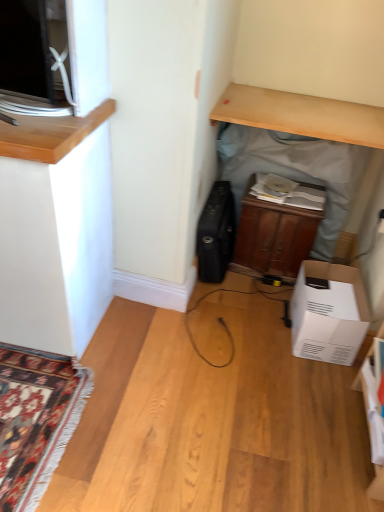
This screenshot has width=384, height=512. Find the location of `vacant space that is in between wooden cabinet at center and black matte suitcase at center`. vacant space that is in between wooden cabinet at center and black matte suitcase at center is located at coordinates (254, 285).